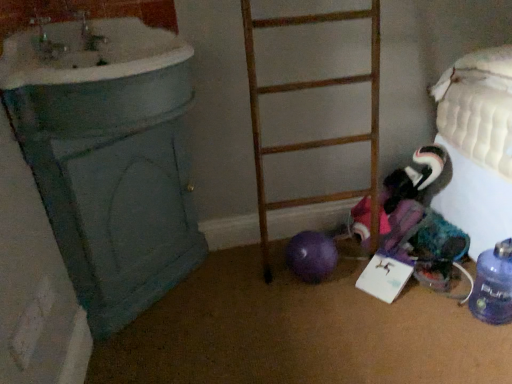
At what (x,y) coordinates should I click in order to perform the action: click on vacant space situated on the left part of blue translucent bottle at lower right. Please return your answer as a coordinate pair (x, y). This screenshot has height=384, width=512. Looking at the image, I should click on (438, 318).